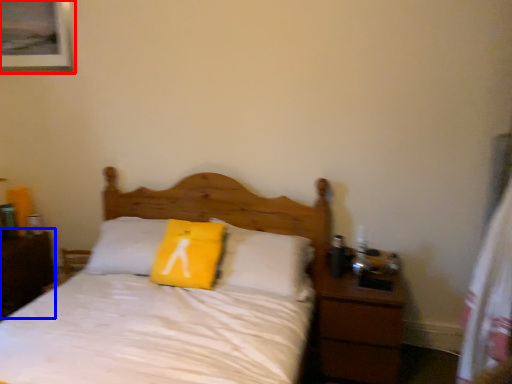
Question: Which of the following is the closest to the observer, picture frame (highlighted by a red box) or nightstand (highlighted by a blue box)?

Choices:
 (A) picture frame
 (B) nightstand

Answer: (B)